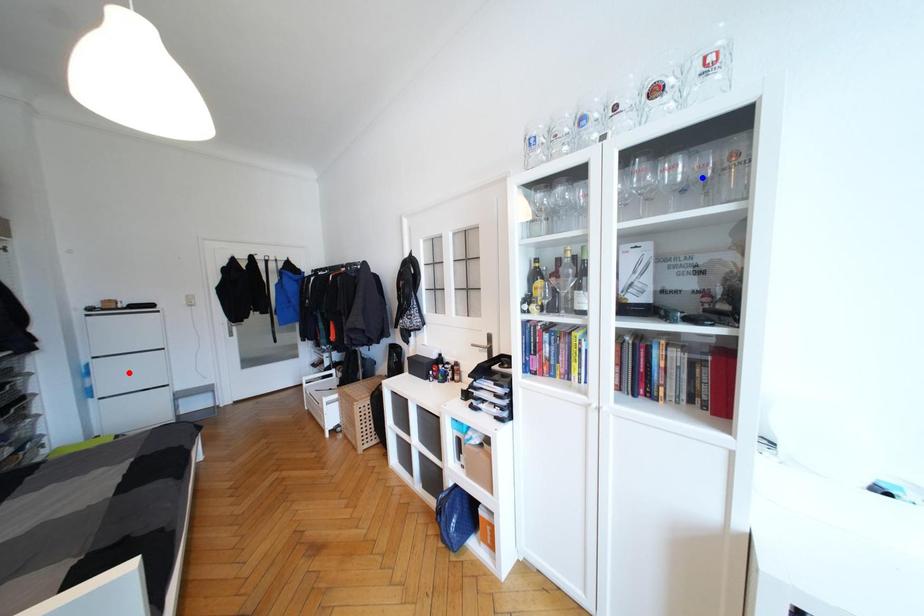
Question: Which of the two points in the image is closer to the camera?

Choices:
 (A) Blue point is closer.
 (B) Red point is closer.

Answer: (A)